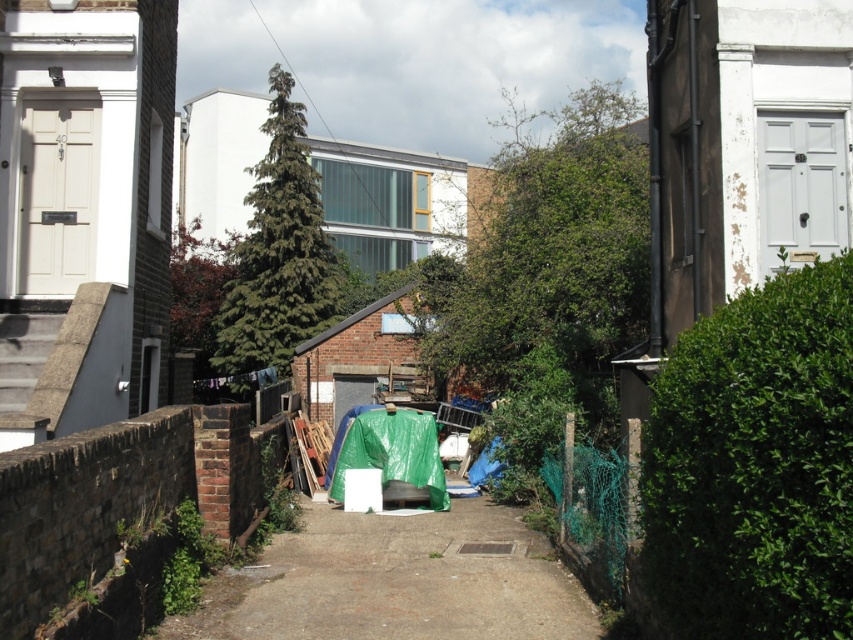
Question: Where is green leafy hedge at right located in relation to green leafy hedge at center in the image?

Choices:
 (A) above
 (B) below

Answer: (B)

Question: Can you confirm if green leafy hedge at right is positioned to the left of green leafy hedge at center?

Choices:
 (A) no
 (B) yes

Answer: (A)

Question: Estimate the real-world distances between objects in this image. Which object is farther from the dull concrete path at center?

Choices:
 (A) green leafy hedge at right
 (B) green leafy hedge at center

Answer: (B)

Question: Can you confirm if green leafy hedge at right is positioned to the left of dull concrete path at center?

Choices:
 (A) yes
 (B) no

Answer: (B)

Question: Which object is positioned farthest from the green leafy hedge at center?

Choices:
 (A) dull concrete path at center
 (B) green leafy hedge at right

Answer: (B)

Question: Which point appears closest to the camera in this image?

Choices:
 (A) (553, 557)
 (B) (280, 68)
 (C) (722, 502)

Answer: (C)